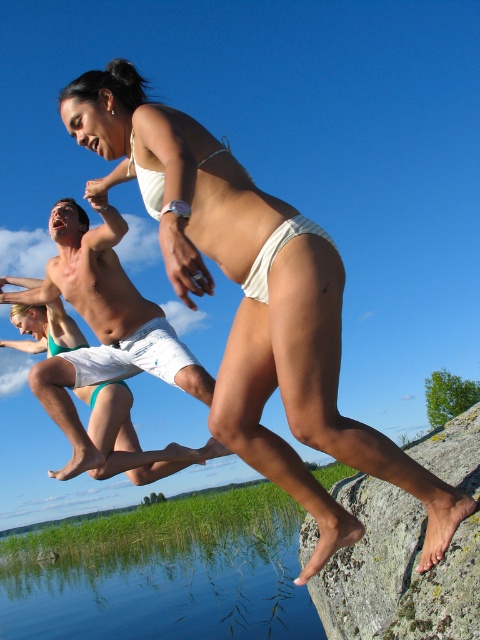
Question: Which of the following is the closest to the observer?

Choices:
 (A) white matte bikini bottom at center
 (B) gray rough rock at lower right

Answer: (A)

Question: Is white matte bikini bottom at center above white cotton shorts at center?

Choices:
 (A) no
 (B) yes

Answer: (B)

Question: Which point is closer to the camera?

Choices:
 (A) white matte bikini bottom at center
 (B) gray rough rock at lower right
 (C) white matte bikini top at center
 (D) white cotton shorts at center

Answer: (A)

Question: Can you confirm if white matte bikini bottom at center is positioned below gray rough rock at lower right?

Choices:
 (A) yes
 (B) no

Answer: (B)

Question: Which object is positioned farthest from the gray rough rock at lower right?

Choices:
 (A) white matte bikini top at center
 (B) white matte bikini bottom at center

Answer: (A)

Question: Can you confirm if gray rough rock at lower right is smaller than white fabric bikini bottom at center?

Choices:
 (A) no
 (B) yes

Answer: (A)